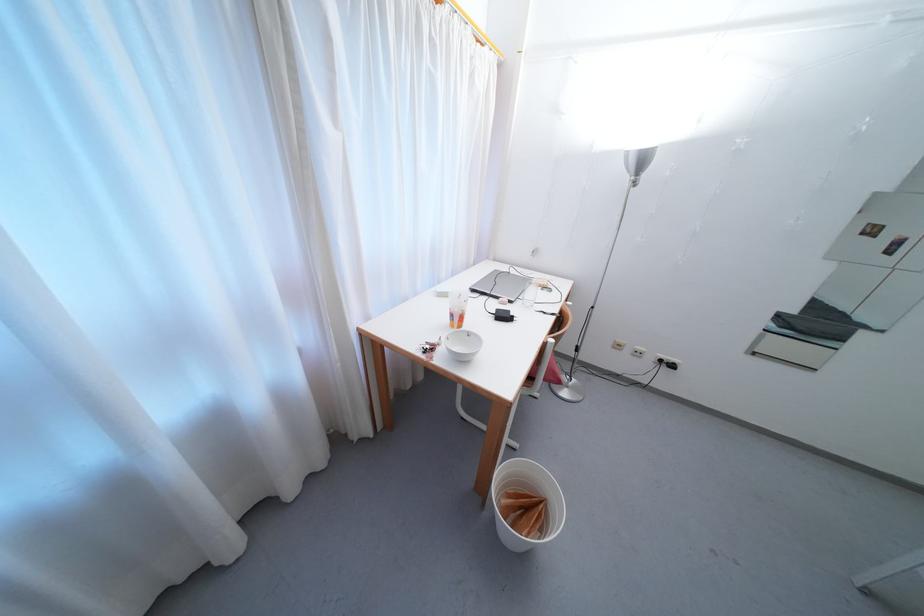
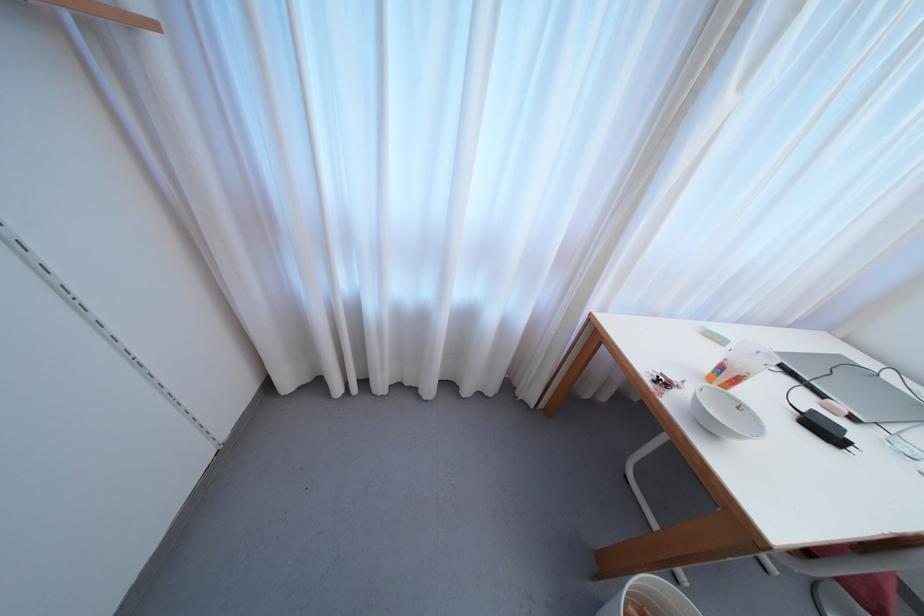
The point at (502, 313) is marked in the first image. Where is the corresponding point in the second image?

(817, 415)